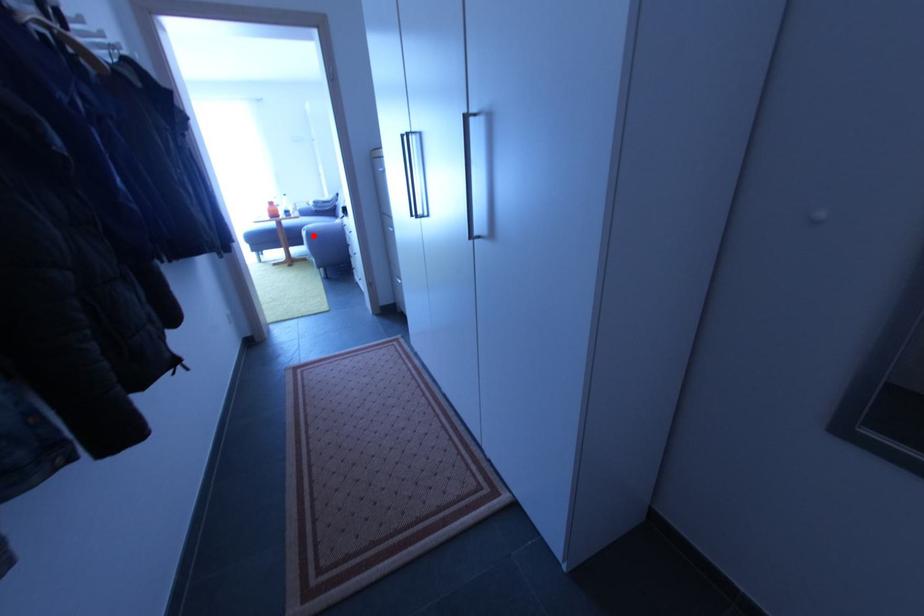
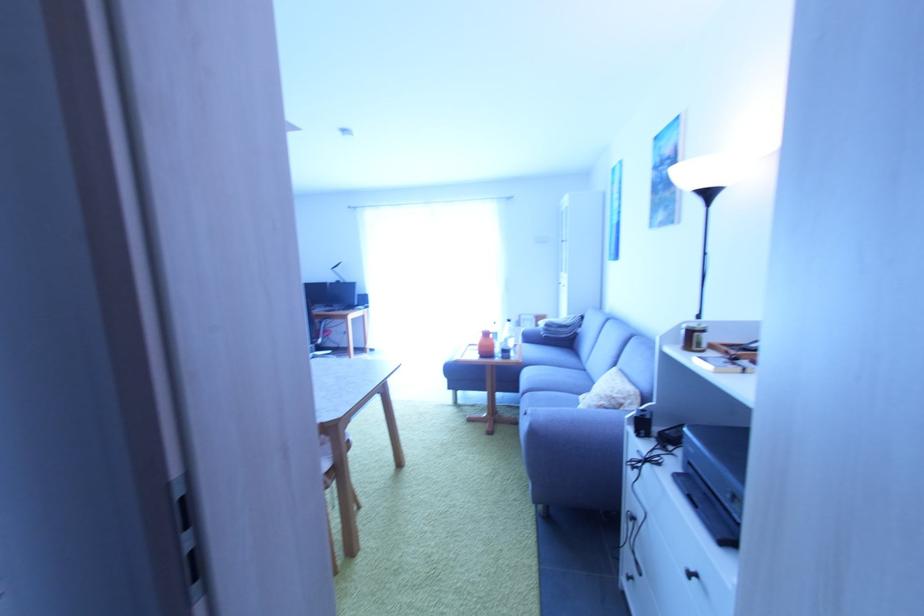
Question: I am providing you with two images of the same scene from different viewpoints. In image1, a red point is highlighted. Considering the same 3D point in image2, which of the following is correct?

Choices:
 (A) It is closer
 (B) It is farther

Answer: (B)